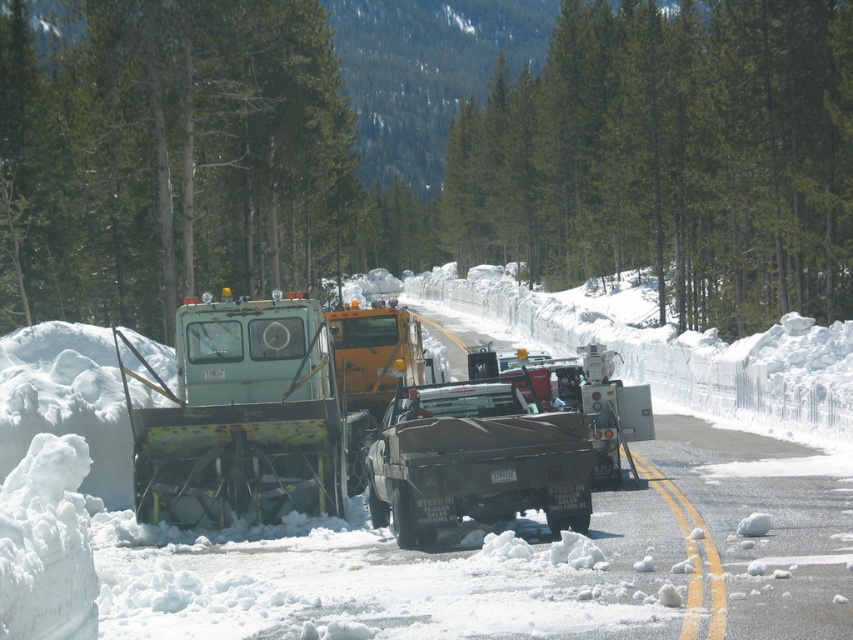
Does point (828, 248) lie behind point (184, 467)?

Yes.

Is the position of green matte tree at center more distant than that of green matte snowplow at center?

Yes, green matte tree at center is behind green matte snowplow at center.

Is point (563, 84) behind point (331, 349)?

Yes, point (563, 84) is behind point (331, 349).

Find the location of a particular element. The width and height of the screenshot is (853, 640). green matte tree at center is located at coordinates (437, 156).

Is white fluffy snow at center positioned in front of green textured pine trees at center?

Yes, white fluffy snow at center is closer to the viewer.

Is point (656, 417) behind point (666, 97)?

No.

Where is `white fluffy snow at center`? The width and height of the screenshot is (853, 640). white fluffy snow at center is located at coordinates (537, 548).

Image resolution: width=853 pixels, height=640 pixels. What do you see at coordinates (241, 417) in the screenshot?
I see `rusty metal snowplow at left` at bounding box center [241, 417].

The image size is (853, 640). Describe the element at coordinates (241, 417) in the screenshot. I see `rusty metal snowplow at left` at that location.

Where is `rusty metal snowplow at left`? This screenshot has height=640, width=853. rusty metal snowplow at left is located at coordinates (241, 417).